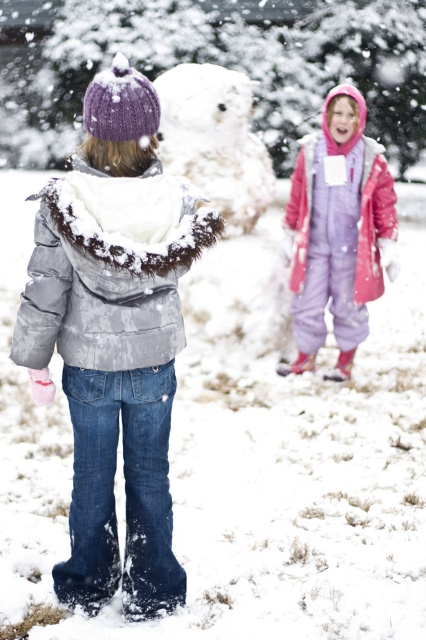
Consider the image. Does white fluffy snowman at center appear on the left side of purple fleece jacket at upper right?

Indeed, white fluffy snowman at center is positioned on the left side of purple fleece jacket at upper right.

Does white fluffy snowman at center have a smaller size compared to purple fleece jacket at upper right?

Actually, white fluffy snowman at center might be larger than purple fleece jacket at upper right.

In the scene shown: Who is more forward, (183, 150) or (388, 209)?

Positioned in front is point (388, 209).

Locate an element on the screen. white fluffy snowman at center is located at coordinates (215, 140).

Can you confirm if fuzzy gray jacket at back is smaller than white fluffy snowman at center?

Indeed, fuzzy gray jacket at back has a smaller size compared to white fluffy snowman at center.

Which is below, fuzzy gray jacket at back or white fluffy snowman at center?

fuzzy gray jacket at back is below.

Does point (39, 280) come behind point (232, 76)?

No, it is in front of (232, 76).

This screenshot has height=640, width=426. Find the location of `fuzzy gray jacket at back`. fuzzy gray jacket at back is located at coordinates (109, 268).

Which of these two, fuzzy gray jacket at back or purple fleece jacket at upper right, stands taller?

purple fleece jacket at upper right is taller.

Which is in front, point (118, 220) or point (302, 266)?

Point (118, 220) is more forward.

Describe the element at coordinates (109, 268) in the screenshot. I see `fuzzy gray jacket at back` at that location.

Identify the location of fuzzy gray jacket at back. (109, 268).